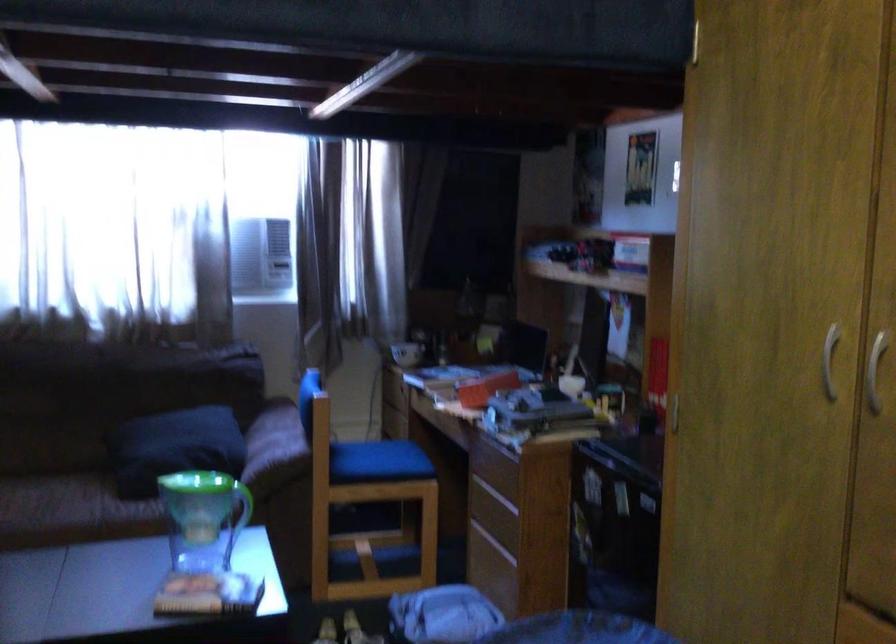
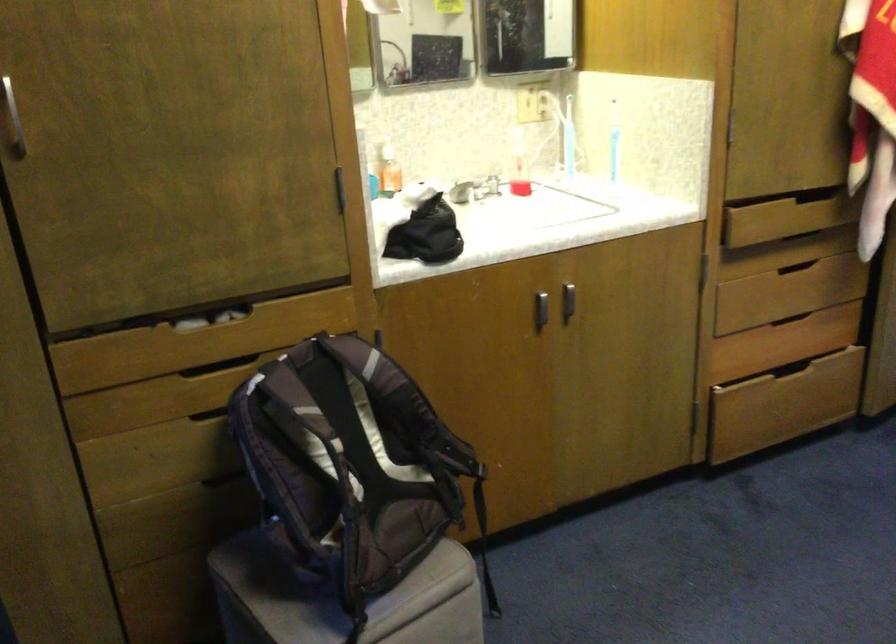
The images are taken continuously from a first-person perspective. In which direction is your viewpoint rotating?

The camera's rotation is toward right-down.